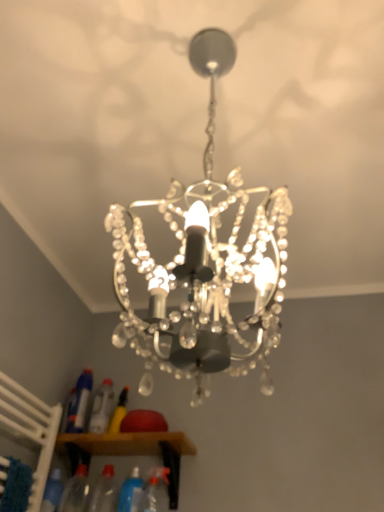
Question: Does transparent plastic bottle at lower center, the fourth bottle from the left, lie behind translucent plastic spray bottle at lower left, positioned as the first bottle in left-to-right order?

Choices:
 (A) yes
 (B) no

Answer: (B)

Question: Is the position of transparent plastic bottle at lower center, the fourth bottle from the left, less distant than that of translucent plastic spray bottle at lower left, positioned as the first bottle in left-to-right order?

Choices:
 (A) yes
 (B) no

Answer: (A)

Question: Does transparent plastic bottle at lower center, the fourth bottle from the left, have a greater height compared to translucent plastic spray bottle at lower left, positioned as the first bottle in left-to-right order?

Choices:
 (A) no
 (B) yes

Answer: (A)

Question: Does transparent plastic bottle at lower center, the 3th bottle positioned from the right, touch translucent plastic spray bottle at lower left, the 6th bottle in the right-to-left sequence?

Choices:
 (A) no
 (B) yes

Answer: (A)

Question: Is transparent plastic bottle at lower center, the 3th bottle positioned from the right, to the left of translucent plastic spray bottle at lower left, positioned as the first bottle in left-to-right order, from the viewer's perspective?

Choices:
 (A) yes
 (B) no

Answer: (B)

Question: Considering the positions of blue translucent bottle at lower center, the 5th bottle in the left-to-right sequence, and transparent plastic bottle at lower center, the fourth bottle from the left, in the image, is blue translucent bottle at lower center, the 5th bottle in the left-to-right sequence, wider or thinner than transparent plastic bottle at lower center, the fourth bottle from the left,?

Choices:
 (A) thin
 (B) wide

Answer: (A)

Question: From a real-world perspective, is blue translucent bottle at lower center, the second bottle from the right, above or below transparent plastic bottle at lower center, the fourth bottle from the left?

Choices:
 (A) below
 (B) above

Answer: (B)

Question: From their relative heights in the image, would you say blue translucent bottle at lower center, the 5th bottle in the left-to-right sequence, is taller or shorter than transparent plastic bottle at lower center, the fourth bottle from the left?

Choices:
 (A) tall
 (B) short

Answer: (A)

Question: From the image's perspective, relative to transparent plastic bottle at lower center, the 3th bottle positioned from the right, is blue translucent bottle at lower center, the second bottle from the right, above or below?

Choices:
 (A) below
 (B) above

Answer: (B)

Question: Visually, is translucent plastic spray bottle at lower left, the 6th bottle in the right-to-left sequence, positioned to the left or to the right of transparent plastic bottle at lower center, the 3th bottle positioned from the right?

Choices:
 (A) left
 (B) right

Answer: (A)

Question: Considering the positions of translucent plastic spray bottle at lower left, the 6th bottle in the right-to-left sequence, and transparent plastic bottle at lower center, the fourth bottle from the left, in the image, is translucent plastic spray bottle at lower left, the 6th bottle in the right-to-left sequence, wider or thinner than transparent plastic bottle at lower center, the fourth bottle from the left,?

Choices:
 (A) thin
 (B) wide

Answer: (A)

Question: From the image's perspective, is translucent plastic spray bottle at lower left, positioned as the first bottle in left-to-right order, above or below transparent plastic bottle at lower center, the fourth bottle from the left?

Choices:
 (A) below
 (B) above

Answer: (B)

Question: Considering the positions of point (69, 411) and point (112, 497), is point (69, 411) closer or farther from the camera than point (112, 497)?

Choices:
 (A) closer
 (B) farther

Answer: (B)

Question: Considering their positions, is wooden cabinet at lower center located in front of or behind transparent plastic bottle at lower center, the fourth bottle from the left?

Choices:
 (A) behind
 (B) front

Answer: (A)

Question: Considering the positions of wooden cabinet at lower center and transparent plastic bottle at lower center, the 3th bottle positioned from the right, in the image, is wooden cabinet at lower center bigger or smaller than transparent plastic bottle at lower center, the 3th bottle positioned from the right,?

Choices:
 (A) big
 (B) small

Answer: (A)